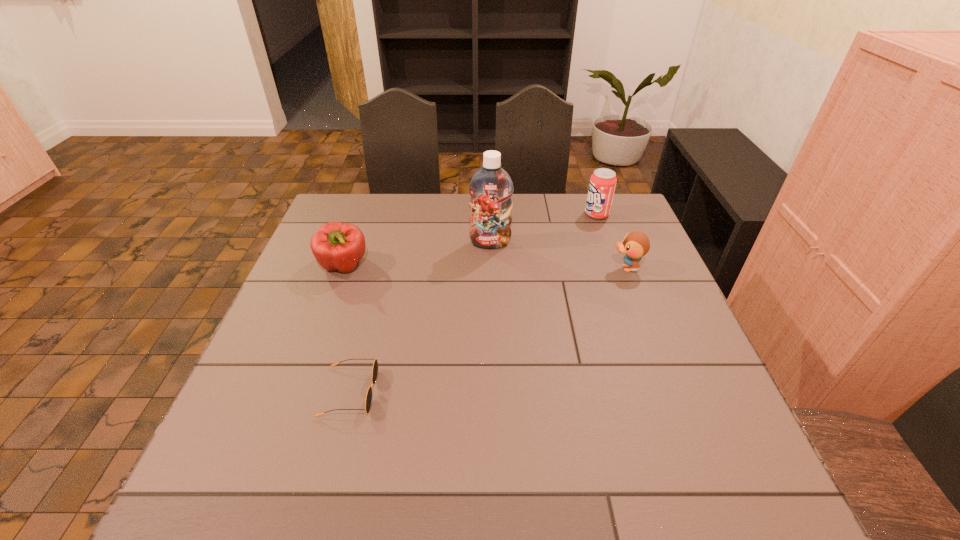
At what (x,y) coordinates should I click in order to perform the action: click on vacant space located 0.120m on the surface of the soda can. Please return your answer as a coordinate pair (x, y). Image resolution: width=960 pixels, height=540 pixels. Looking at the image, I should click on (547, 214).

Where is `vacant area situated 0.390m on the right of the bell pepper`? This screenshot has width=960, height=540. vacant area situated 0.390m on the right of the bell pepper is located at coordinates (508, 266).

Locate an element on the screen. free space located on the front-facing side of the duck is located at coordinates (566, 268).

Identify the location of vacant space located 0.230m on the front-facing side of the duck. (527, 268).

Where is `free location located on the front-facing side of the duck`? The height and width of the screenshot is (540, 960). free location located on the front-facing side of the duck is located at coordinates pyautogui.click(x=552, y=268).

The width and height of the screenshot is (960, 540). Identify the location of vacant area located on the front-facing side of the nearest object. (399, 392).

The height and width of the screenshot is (540, 960). I want to click on object situated at the far edge, so click(x=603, y=181).

What are the coordinates of `object located at the left edge` in the screenshot? It's located at (338, 246).

You are a GUI agent. You are given a task and a screenshot of the screen. Output one action in this format:
    pyautogui.click(x=<x>, y=<y>)
    Task: Click on the soda can that is at the right edge
    This screenshot has height=540, width=960.
    Given the screenshot: What is the action you would take?
    pyautogui.click(x=603, y=181)

This screenshot has width=960, height=540. I want to click on duck that is at the right edge, so [636, 244].